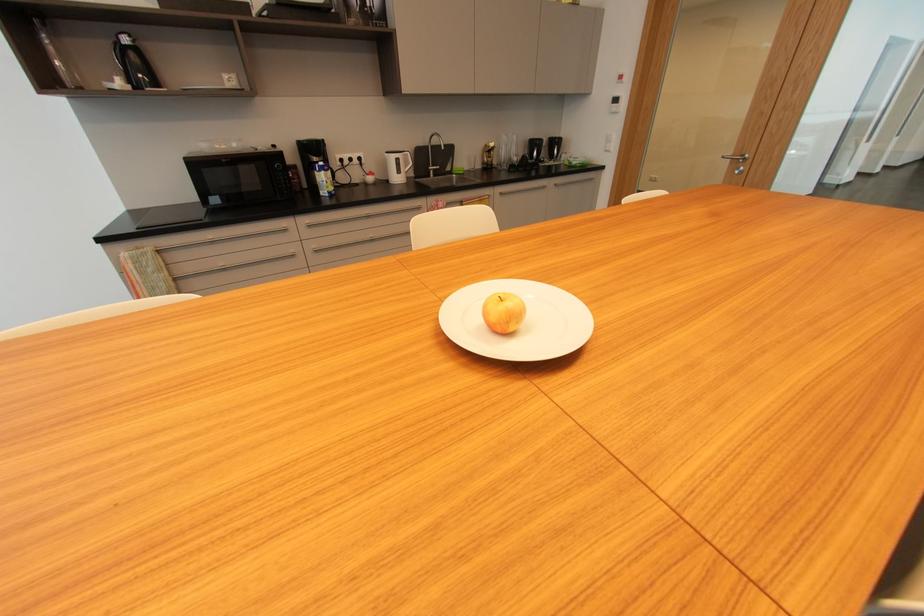
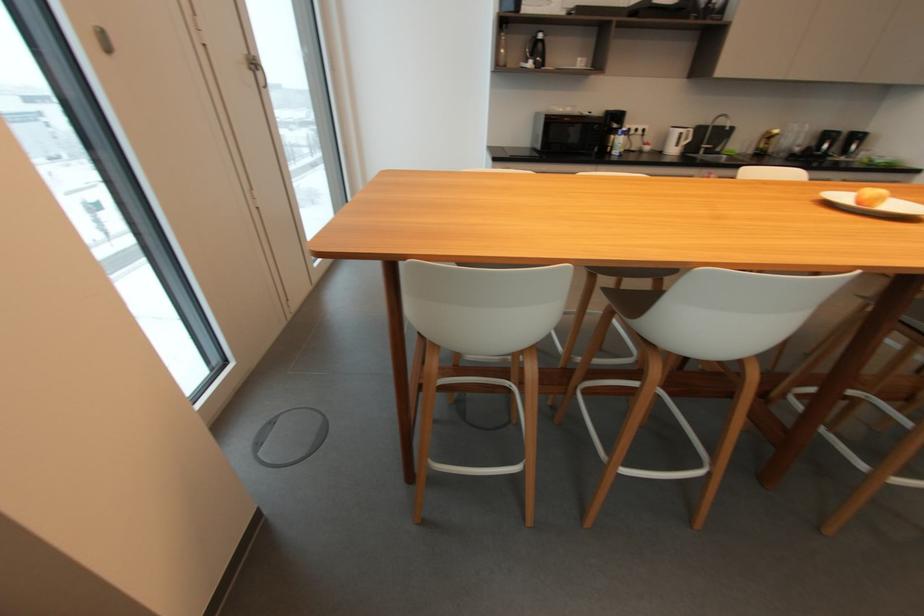
In the second image, find the point that corresponds to (128,41) in the first image.

(544, 36)